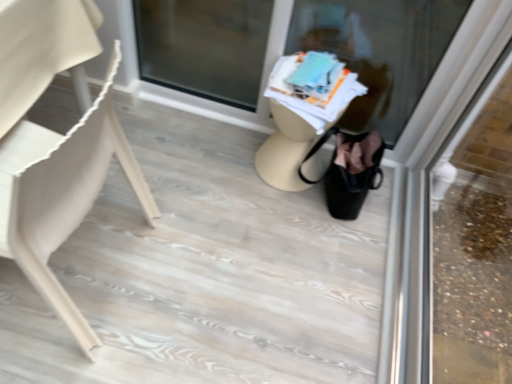
This screenshot has height=384, width=512. In order to click on vacant area in front of translucent glass at center, the 2th shop window in the right-to-left sequence in this screenshot , I will do `click(244, 240)`.